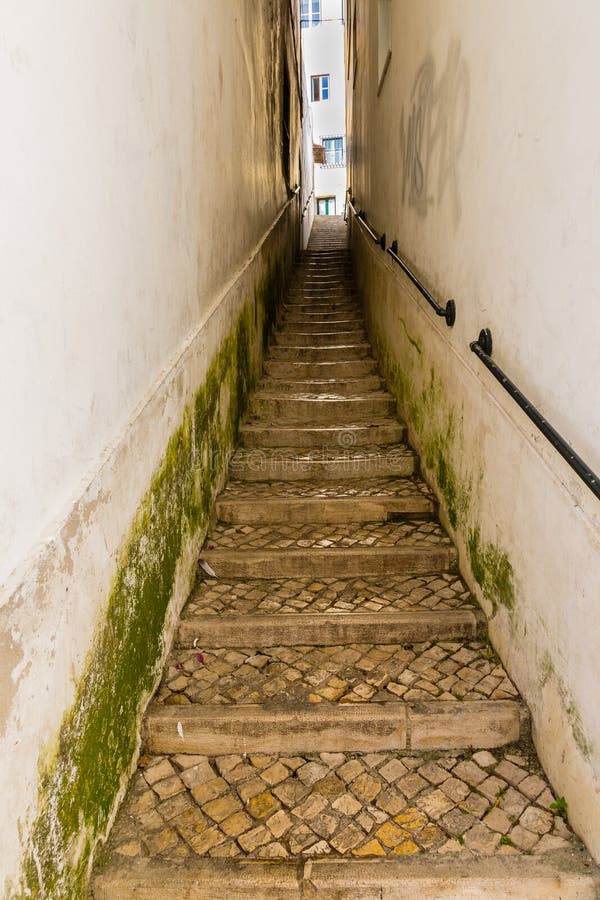
The height and width of the screenshot is (900, 600). Identify the location of hand rails. (518, 400), (437, 308), (370, 228), (351, 200), (348, 190), (303, 208), (309, 194).